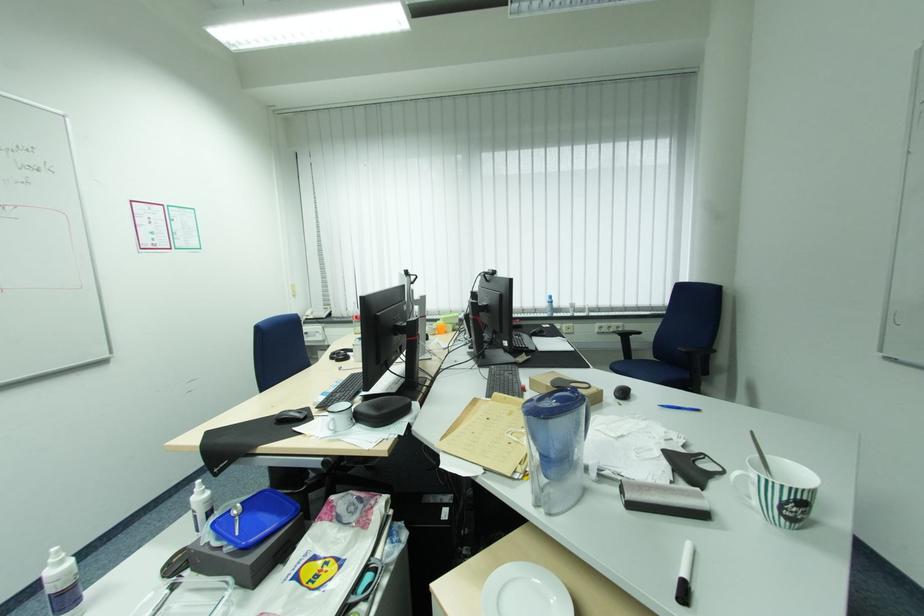
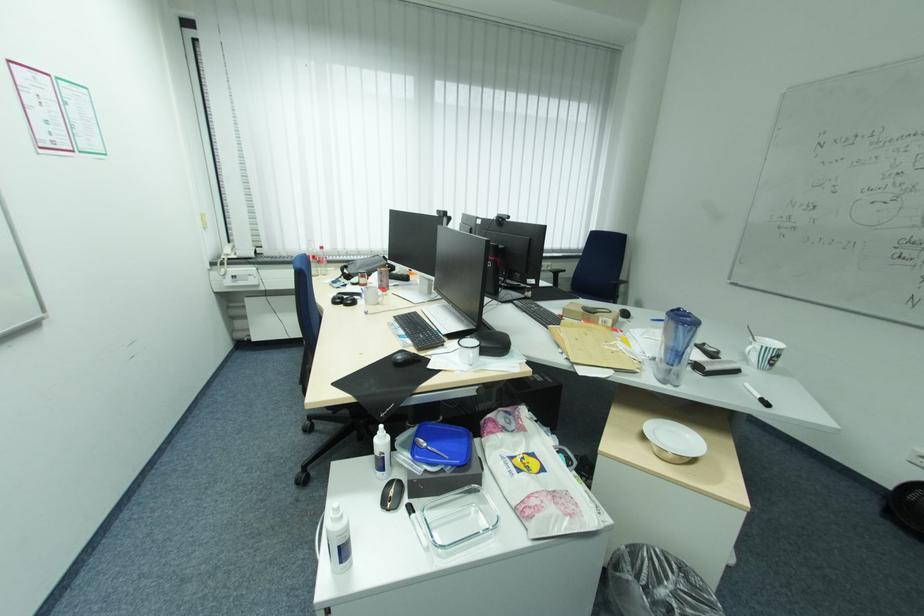
The point at (624, 326) is marked in the first image. Where is the corresponding point in the second image?

(554, 265)